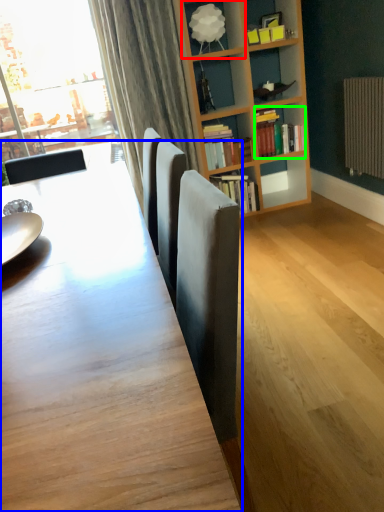
Question: Which object is positioned farthest from shelf (highlighted by a red box)? Select from table (highlighted by a blue box) and book (highlighted by a green box).

Choices:
 (A) table
 (B) book

Answer: (A)